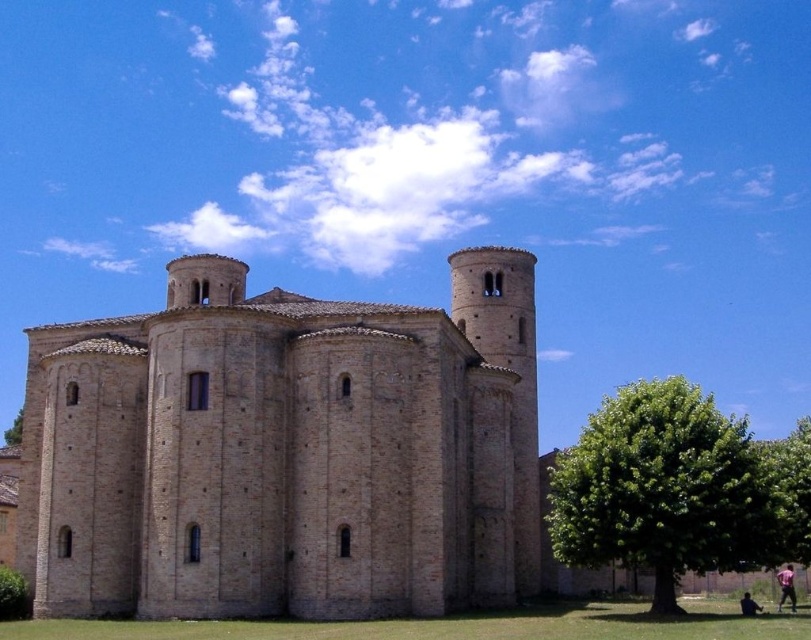
You are standing in front of the beige stone church at center and want to take a photo of the green leafy tree at lower right. Which direction should you move to ensure the tree is in the frame?

The beige stone church at center is above the green leafy tree at lower right, so you should move downward or to the lower right to include the tree in your photo.